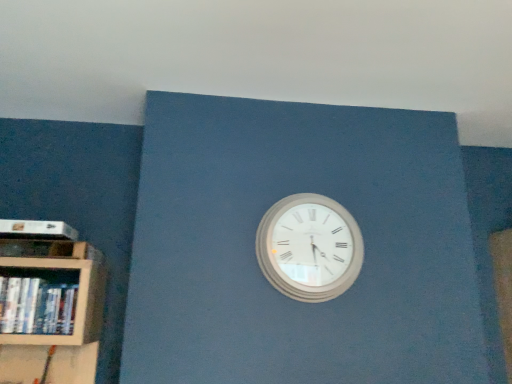
Question: From a real-world perspective, is white matte paperback book at left positioned under white glossy book at left based on gravity?

Choices:
 (A) no
 (B) yes

Answer: (A)

Question: From the image's perspective, is white matte paperback book at left located above white glossy book at left?

Choices:
 (A) no
 (B) yes

Answer: (B)

Question: Is the depth of white matte paperback book at left greater than that of white glossy book at left?

Choices:
 (A) yes
 (B) no

Answer: (A)

Question: Can you confirm if white matte paperback book at left is thinner than white glossy book at left?

Choices:
 (A) no
 (B) yes

Answer: (A)

Question: Considering the relative sizes of white matte paperback book at left and white glossy book at left in the image provided, is white matte paperback book at left smaller than white glossy book at left?

Choices:
 (A) no
 (B) yes

Answer: (B)

Question: Looking at the image, does white glossy book at left seem bigger or smaller compared to white wooden wall clock at center?

Choices:
 (A) small
 (B) big

Answer: (A)

Question: From a real-world perspective, is white glossy book at left physically located above or below white wooden wall clock at center?

Choices:
 (A) below
 (B) above

Answer: (A)

Question: Does point (9, 288) appear closer or farther from the camera than point (291, 213)?

Choices:
 (A) closer
 (B) farther

Answer: (A)

Question: Which is correct: white glossy book at left is inside white wooden wall clock at center, or outside of it?

Choices:
 (A) outside
 (B) inside

Answer: (A)

Question: Choose the correct answer: Is white matte paperback book at left inside white glossy book at left or outside it?

Choices:
 (A) outside
 (B) inside

Answer: (A)

Question: Is white matte paperback book at left wider or thinner than white glossy book at left?

Choices:
 (A) thin
 (B) wide

Answer: (B)

Question: From a real-world perspective, is white matte paperback book at left above or below white glossy book at left?

Choices:
 (A) above
 (B) below

Answer: (A)

Question: Considering the positions of point (74, 236) and point (36, 332), is point (74, 236) closer or farther from the camera than point (36, 332)?

Choices:
 (A) closer
 (B) farther

Answer: (B)

Question: Choose the correct answer: Is white glossy book at left inside white matte paperback book at left or outside it?

Choices:
 (A) outside
 (B) inside

Answer: (A)

Question: From the image's perspective, relative to white matte paperback book at left, is white glossy book at left above or below?

Choices:
 (A) below
 (B) above

Answer: (A)